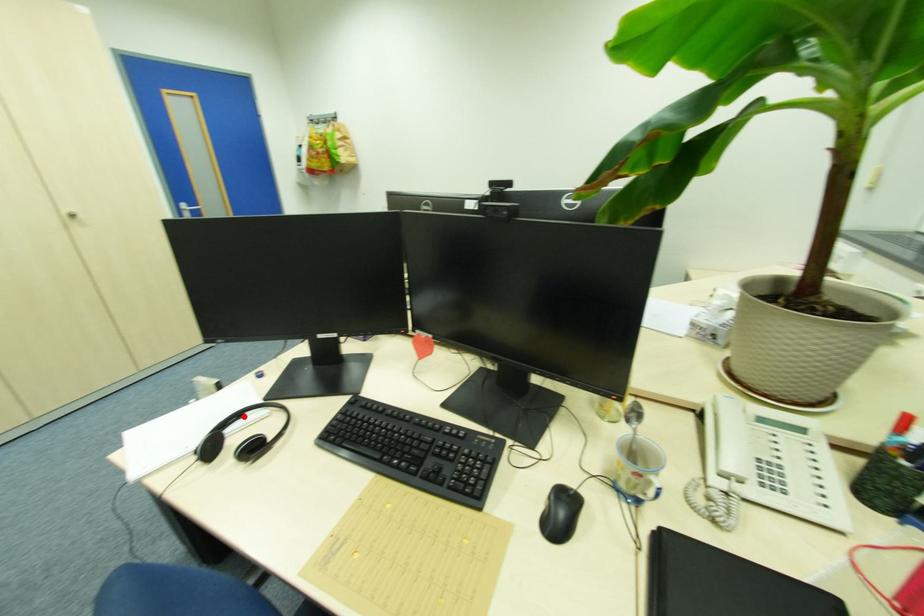
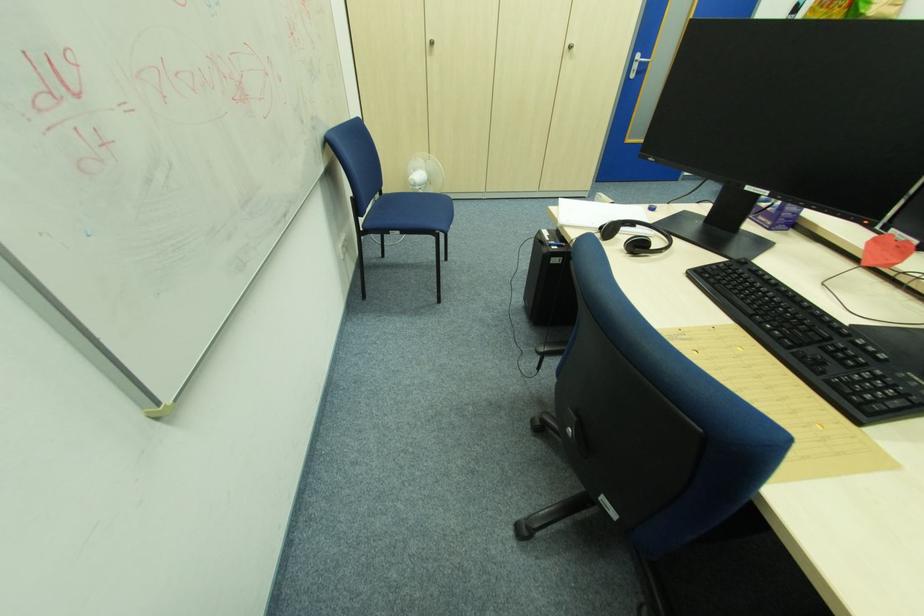
The point at the highlighted location is marked in the first image. Where is the corresponding point in the second image?

(637, 225)